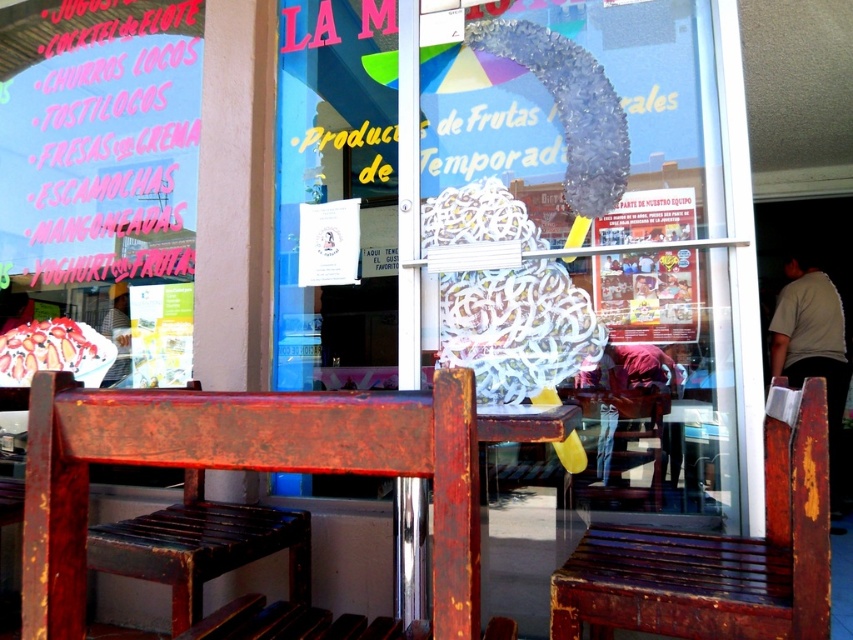
Is point (782, 627) positioned behind point (647, 432)?

That is False.

Is point (740, 632) closer to viewer compared to point (614, 401)?

Yes, it is.

This screenshot has width=853, height=640. I want to click on rusty wood bench at lower center, so click(717, 557).

Is rusty wood chair at center closer to camera compared to rusty wood bench at lower center?

Yes, it is in front of rusty wood bench at lower center.

Consider the image. Which of these two, rusty wood chair at center or rusty wood bench at lower center, stands taller?

With more height is rusty wood bench at lower center.

Is point (289, 435) closer to camera compared to point (744, 564)?

Yes.

Identify the location of rusty wood chair at center. (x=244, y=468).

In the scene shown: Is transparent plastic wreath at center to the right of rusty wooden chair at lower center from the viewer's perspective?

Incorrect, transparent plastic wreath at center is not on the right side of rusty wooden chair at lower center.

Which of these two, transparent plastic wreath at center or rusty wooden chair at lower center, stands taller?

With more height is transparent plastic wreath at center.

Does point (450, 157) come closer to viewer compared to point (589, 496)?

That is False.

Find the location of a particular element. transparent plastic wreath at center is located at coordinates (534, 220).